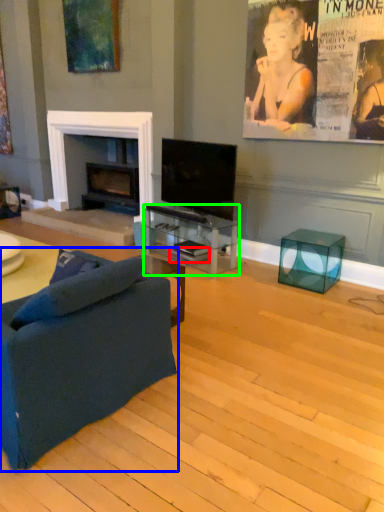
Question: Which object is positioned closest to magazine (highlighted by a red box)? Select from studio couch (highlighted by a blue box) and table (highlighted by a green box).

Choices:
 (A) studio couch
 (B) table

Answer: (B)